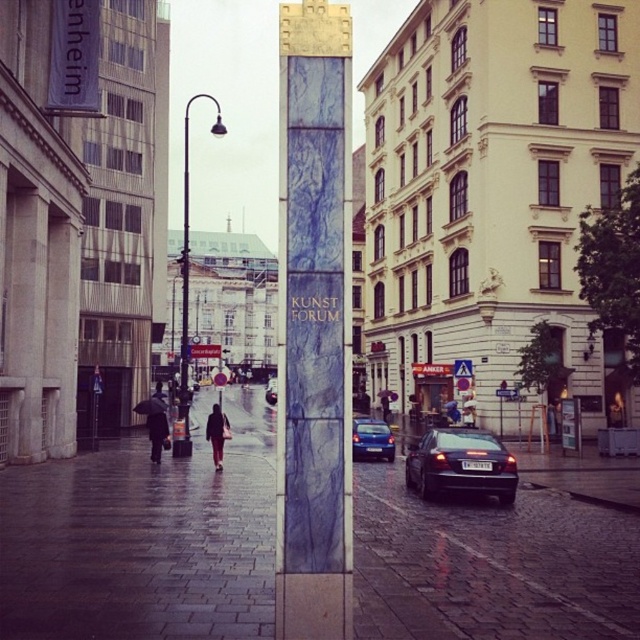
Where is `blue marble pillar at center`? The height and width of the screenshot is (640, 640). blue marble pillar at center is located at coordinates pyautogui.click(x=314, y=324).

Can you confirm if blue marble pillar at center is taller than metallic blue sedan at center?

Indeed, blue marble pillar at center has a greater height compared to metallic blue sedan at center.

Does point (312, 609) come farther from viewer compared to point (376, 432)?

No, it is in front of (376, 432).

Find the location of a particular element. The image size is (640, 640). blue marble pillar at center is located at coordinates (314, 324).

Who is shorter, dark brown leather coat at center or shiny blue sedan at center?

dark brown leather coat at center is shorter.

Can you confirm if dark brown leather coat at center is shorter than shiny blue sedan at center?

Indeed, dark brown leather coat at center has a lesser height compared to shiny blue sedan at center.

In order to click on dark brown leather coat at center in this screenshot , I will do `click(216, 433)`.

I want to click on dark brown leather coat at center, so click(216, 433).

This screenshot has height=640, width=640. Describe the element at coordinates (371, 440) in the screenshot. I see `metallic blue sedan at center` at that location.

Who is more forward, [388,449] or [380,396]?

Point [388,449] is more forward.

Identify the location of metallic blue sedan at center. The width and height of the screenshot is (640, 640). (371, 440).